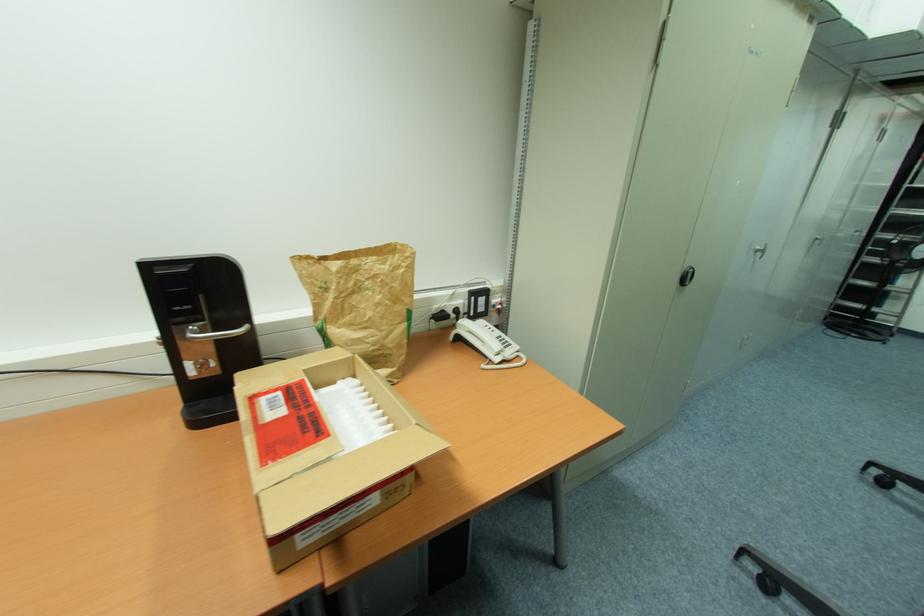
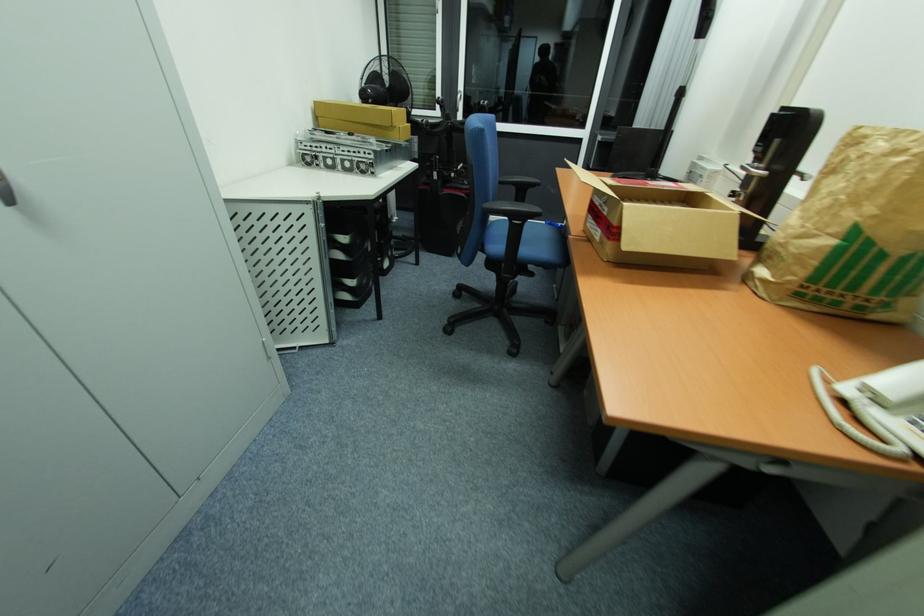
Find the pixel in the second image that matches point 505,347 in the first image.

(915, 424)